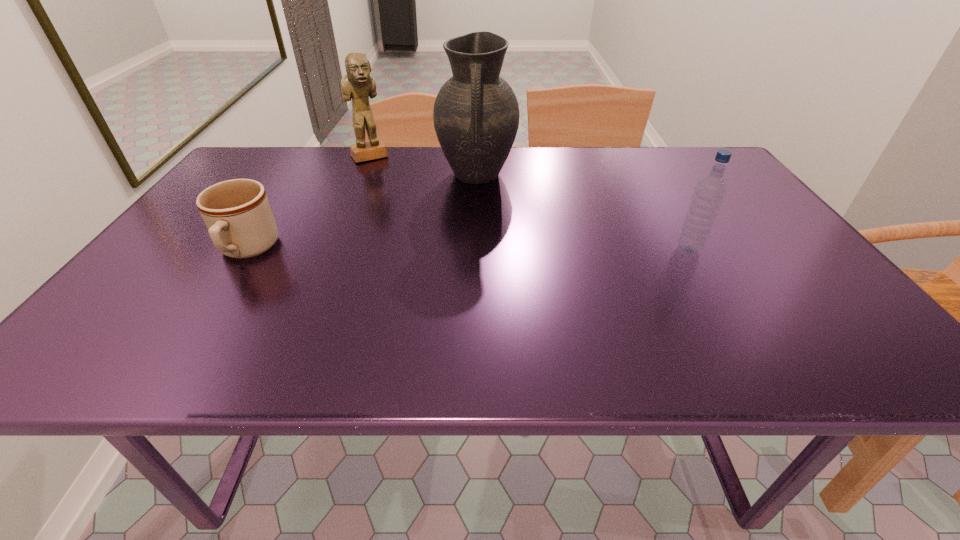
Find the location of a particular element. Image resolution: width=960 pixels, height=540 pixels. unoccupied area between the shortest object and the third tallest object is located at coordinates (468, 250).

In order to click on vacant space in between the third tallest object and the leftmost object in this screenshot , I will do `click(468, 250)`.

Find the location of a particular element. The width and height of the screenshot is (960, 540). free space between the leftmost object and the second tallest object is located at coordinates (308, 203).

At what (x,y) coordinates should I click in order to perform the action: click on free area in between the leftmost object and the rightmost object. Please return your answer as a coordinate pair (x, y). The width and height of the screenshot is (960, 540). Looking at the image, I should click on click(468, 250).

Locate an element on the screen. the third closest object to the shortest object is located at coordinates (709, 192).

The image size is (960, 540). In order to click on object that is the nearest to the mug in this screenshot , I will do `click(358, 84)`.

In order to click on vacant region that satisfies the following two spatial constraints: 1. on the front side of the rightmost object; 2. on the right side of the pitcher in this screenshot , I will do `click(476, 250)`.

Find the location of a particular element. free point that satisfies the following two spatial constraints: 1. on the front side of the figurine; 2. on the right side of the water bottle is located at coordinates (330, 250).